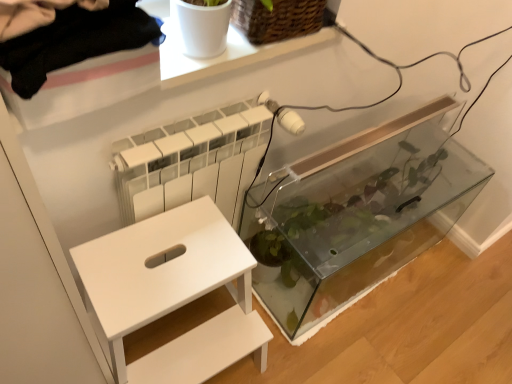
Question: Is point (122, 271) closer or farther from the camera than point (330, 274)?

Choices:
 (A) closer
 (B) farther

Answer: (A)

Question: Is white matte step stool at lower left wider or thinner than transparent glass tank at center?

Choices:
 (A) wide
 (B) thin

Answer: (A)

Question: Considering the real-world distances, which object is farthest from the transparent glass tank at center?

Choices:
 (A) woven brown basket at upper center
 (B) white matte step stool at lower left

Answer: (A)

Question: Which of these objects is positioned farthest from the woven brown basket at upper center?

Choices:
 (A) transparent glass tank at center
 (B) white matte step stool at lower left

Answer: (A)